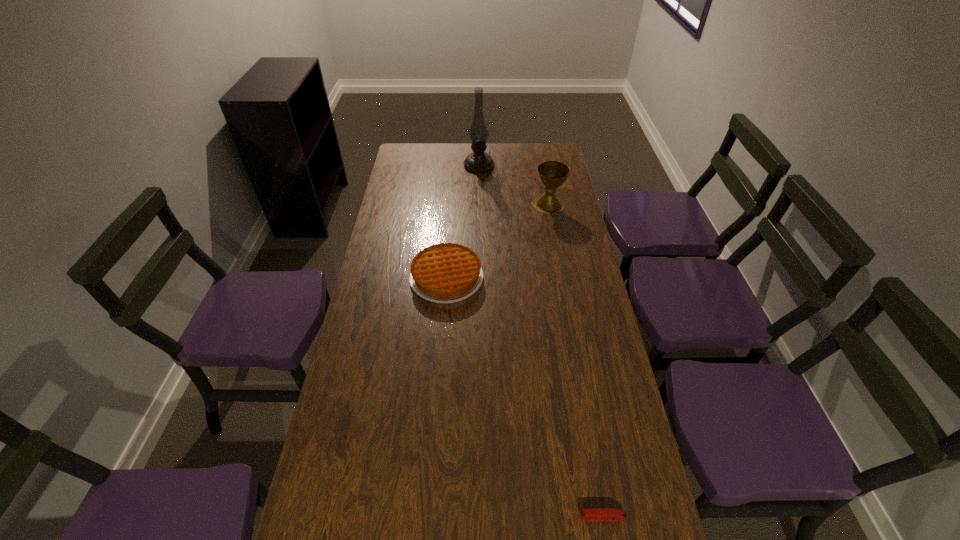
Locate an element on the screen. The height and width of the screenshot is (540, 960). vacant space situated 0.400m on the front of the second shortest object is located at coordinates (436, 419).

Find the location of `free space located 0.160m on the front-facing side of the nearest object`. free space located 0.160m on the front-facing side of the nearest object is located at coordinates (510, 517).

At what (x,y) coordinates should I click in order to perform the action: click on free space located on the front-facing side of the nearest object. Please return your answer as a coordinate pair (x, y). Looking at the image, I should click on (554, 517).

At what (x,y) coordinates should I click in order to perform the action: click on vacant space located on the front-facing side of the nearest object. Please return your answer as a coordinate pair (x, y). This screenshot has width=960, height=540. Looking at the image, I should click on (527, 517).

Where is `object situated at the far edge`? Image resolution: width=960 pixels, height=540 pixels. object situated at the far edge is located at coordinates pos(479,161).

At what (x,y) coordinates should I click in order to perform the action: click on object located at the left edge. Please return your answer as a coordinate pair (x, y). Looking at the image, I should click on (444, 273).

The image size is (960, 540). In order to click on chalice present at the right edge in this screenshot , I will do `click(552, 174)`.

Find the location of a particular element. Image resolution: width=960 pixels, height=540 pixels. stapler that is at the right edge is located at coordinates (610, 514).

In order to click on vacant space at the far edge of the desktop in this screenshot , I will do `click(446, 151)`.

Locate an element on the screen. This screenshot has height=540, width=960. vacant space at the left edge of the desktop is located at coordinates (396, 185).